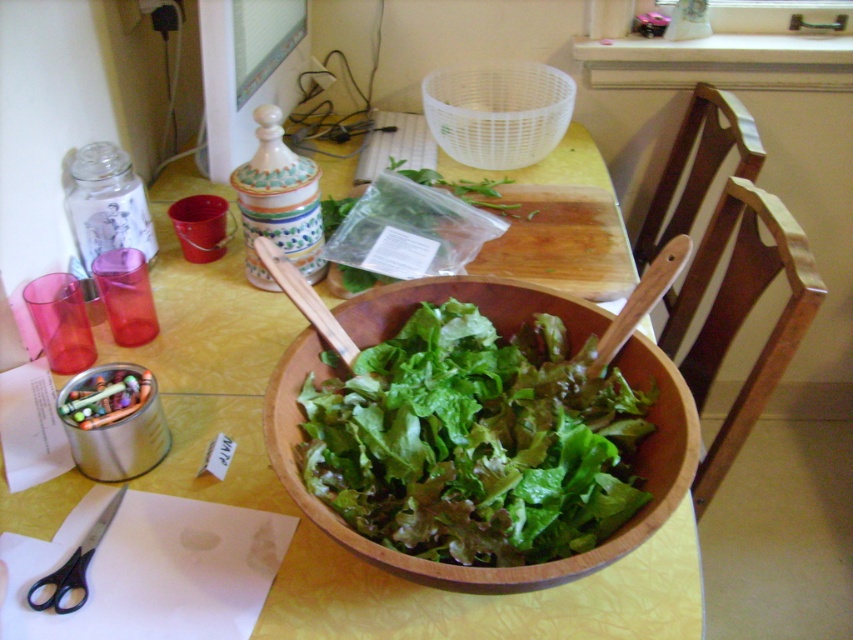
The image size is (853, 640). What do you see at coordinates (402, 230) in the screenshot? I see `translucent plastic bag at center` at bounding box center [402, 230].

Who is more forward, (325, 218) or (94, 390)?

Point (94, 390) is more forward.

I want to click on translucent plastic bag at center, so click(x=402, y=230).

Between wooden bowl at center and translucent plastic bag at center, which one appears on the right side from the viewer's perspective?

Positioned to the right is translucent plastic bag at center.

Does wooden bowl at center appear on the left side of translucent plastic bag at center?

Correct, you'll find wooden bowl at center to the left of translucent plastic bag at center.

Describe the element at coordinates (314, 525) in the screenshot. The image size is (853, 640). I see `wooden bowl at center` at that location.

Where is `wooden bowl at center`? wooden bowl at center is located at coordinates (314, 525).

Who is positioned more to the right, transparent plastic basket at upper center or black plastic scissors at lower left?

From the viewer's perspective, transparent plastic basket at upper center appears more on the right side.

Between point (479, 141) and point (76, 609), which one is positioned behind?

Positioned behind is point (479, 141).

Is point (496, 83) positioned after point (59, 580)?

Yes, point (496, 83) is farther from viewer.

Locate an element on the screen. transparent plastic basket at upper center is located at coordinates pyautogui.click(x=497, y=112).